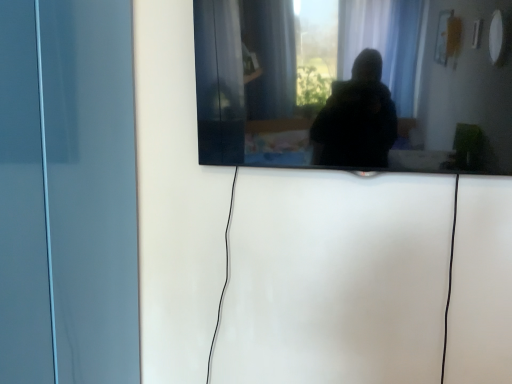
The width and height of the screenshot is (512, 384). What do you see at coordinates (351, 85) in the screenshot?
I see `flat screen tv at upper center` at bounding box center [351, 85].

Locate an element on the screen. flat screen tv at upper center is located at coordinates (351, 85).

This screenshot has height=384, width=512. I want to click on flat screen tv at upper center, so click(351, 85).